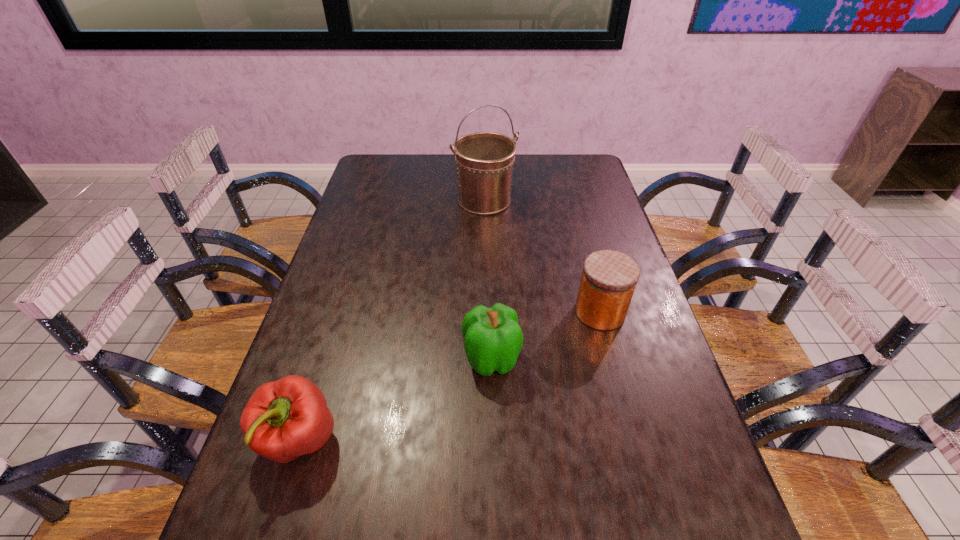
Where is `free space that satisfies the following two spatial constraints: 1. on the front side of the bucket; 2. on the left side of the second nearest object`? free space that satisfies the following two spatial constraints: 1. on the front side of the bucket; 2. on the left side of the second nearest object is located at coordinates (487, 359).